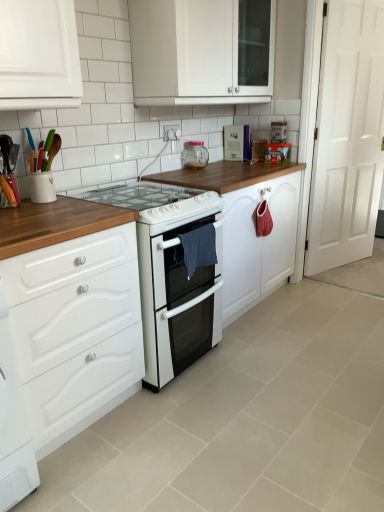
At what (x,y) coordinates should I click in order to perform the action: click on free spot in front of white glossy electric stove at center, the 3th appliance in the back-to-front sequence. Please return your answer as a coordinate pair (x, y). The image size is (384, 512). Looking at the image, I should click on (168, 429).